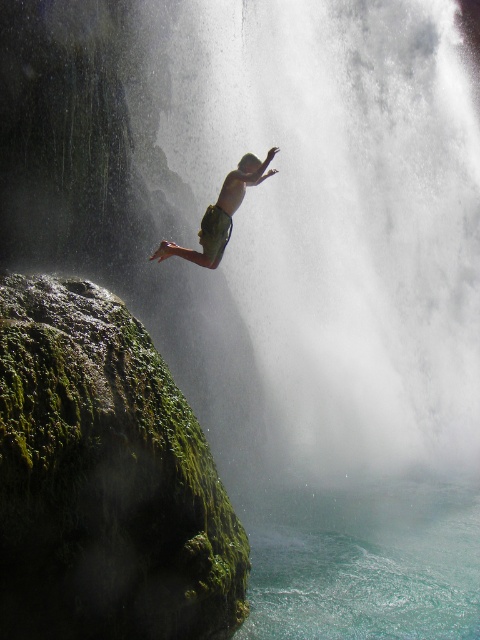
You are a safety inspector assessing the diving area. You notice the turquoise liquid at lower center and the green fabric shorts at center. Which object is higher in the scene?

The green fabric shorts at center are higher than the turquoise liquid at lower center because the liquid is not as tall as the shorts.

You are a safety inspector assessing the diving area. The recommended minimum distance between any rock and the diving zone is 5 meters to prevent collision. Based on the scene, is the green mossy rock at left positioned safely away from the turquoise liquid at lower center?

The distance between the green mossy rock at left and the turquoise liquid at lower center is 4.66 meters, which is less than the recommended 5 meters. Therefore, the rock is too close to the diving zone and poses a safety hazard.

You are a safety inspector assessing the diving area. You notice the turquoise liquid at lower center and the green fabric shorts at center. Which object occupies a larger area in the image?

The turquoise liquid at lower center is bigger than the green fabric shorts at center, so the turquoise liquid at lower center occupies a larger area in the image.